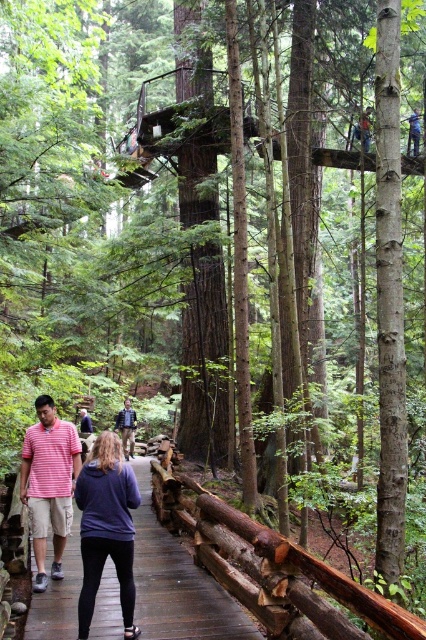
Does point (46, 445) come behind point (365, 131)?

No, (46, 445) is in front of (365, 131).

Who is positioned more to the left, striped cotton shirt at center or green fabric shirt at upper center?

striped cotton shirt at center is more to the left.

Between point (57, 481) and point (365, 115), which one is positioned in front?

Point (57, 481)

The width and height of the screenshot is (426, 640). I want to click on striped cotton shirt at center, so click(x=48, y=483).

Is brown wooden path at lower center positioned in front of green fabric shirt at upper center?

Yes.

From the picture: Between brown wooden path at lower center and green fabric shirt at upper center, which one appears on the right side from the viewer's perspective?

green fabric shirt at upper center is more to the right.

Find the location of a particular element. The image size is (426, 640). brown wooden path at lower center is located at coordinates (178, 582).

Does brown wooden path at lower center have a smaller size compared to dark blue jacket at center?

No.

Based on the photo, can you confirm if brown wooden path at lower center is thinner than dark blue jacket at center?

No.

Does point (68, 550) come closer to viewer compared to point (132, 412)?

Yes, it is.

You are a GUI agent. You are given a task and a screenshot of the screen. Output one action in this format:
    pyautogui.click(x=<x>, y=<y>)
    Task: Click on the brown wooden path at lower center
    This screenshot has width=426, height=640.
    Given the screenshot: What is the action you would take?
    pyautogui.click(x=178, y=582)